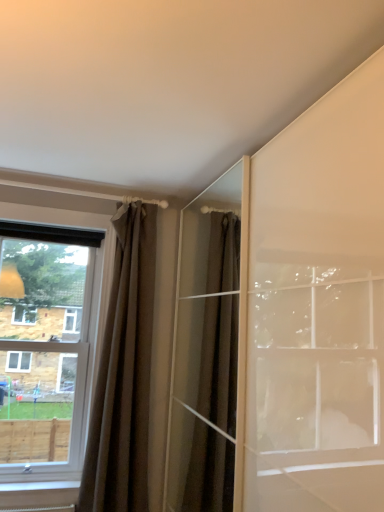
Question: Do you think clear glass window at left is within brown fabric curtain at left, or outside of it?

Choices:
 (A) inside
 (B) outside

Answer: (B)

Question: Would you say clear glass window at left is to the left or to the right of brown fabric curtain at left in the picture?

Choices:
 (A) left
 (B) right

Answer: (A)

Question: Based on their sizes in the image, would you say clear glass window at left is bigger or smaller than brown fabric curtain at left?

Choices:
 (A) big
 (B) small

Answer: (A)

Question: From the image's perspective, is brown fabric curtain at left located above or below clear glass window at left?

Choices:
 (A) below
 (B) above

Answer: (A)

Question: Considering the positions of point (139, 349) and point (62, 465), is point (139, 349) closer or farther from the camera than point (62, 465)?

Choices:
 (A) farther
 (B) closer

Answer: (A)

Question: Is brown fabric curtain at left inside the boundaries of clear glass window at left, or outside?

Choices:
 (A) inside
 (B) outside

Answer: (B)

Question: Would you say brown fabric curtain at left is to the left or to the right of clear glass window at left in the picture?

Choices:
 (A) right
 (B) left

Answer: (A)